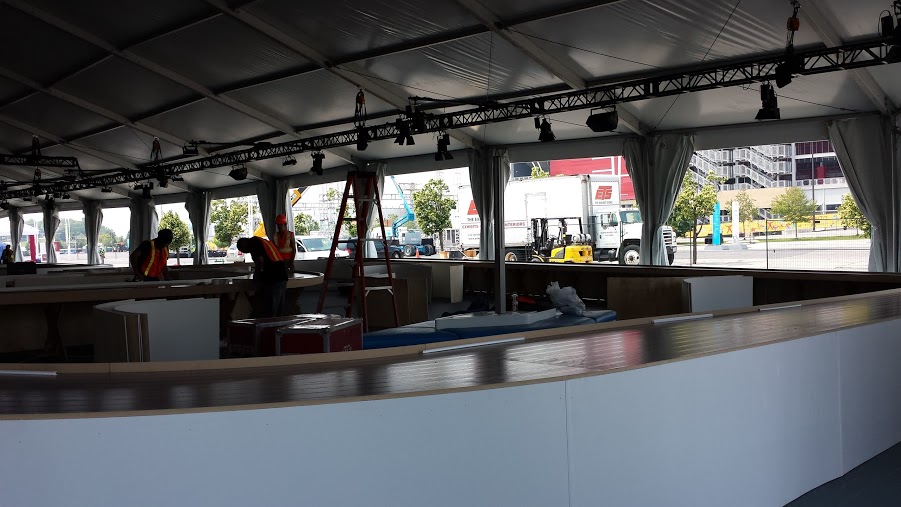
The image size is (901, 507). I want to click on wall, so click(x=215, y=476).